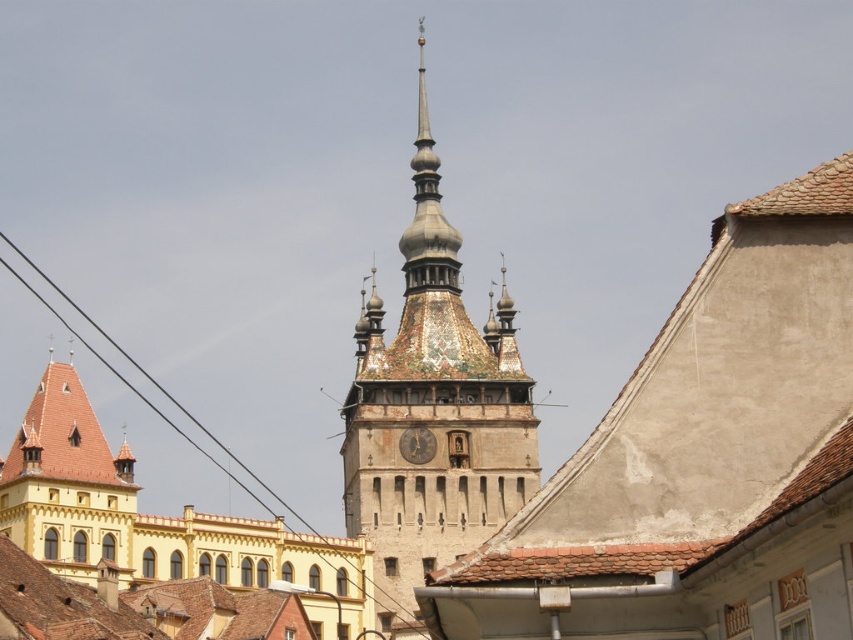
Question: Based on their relative distances, which object is nearer to the yellow brick building at left?

Choices:
 (A) multicolored mosaic clock tower at center
 (B) gold textured clock at center
 (C) brown stone clock tower at center

Answer: (A)

Question: Is multicolored mosaic clock tower at center wider than yellow brick building at left?

Choices:
 (A) no
 (B) yes

Answer: (A)

Question: Can you confirm if multicolored mosaic clock tower at center is positioned below yellow brick building at left?

Choices:
 (A) no
 (B) yes

Answer: (A)

Question: Which point is farther from the camera taking this photo?

Choices:
 (A) (51, 528)
 (B) (421, 460)
 (C) (426, 106)
 (D) (556, 593)

Answer: (C)

Question: Does brown stone clock tower at center appear over yellow brick building at left?

Choices:
 (A) yes
 (B) no

Answer: (A)

Question: Which point appears closest to the camera in this image?

Choices:
 (A) [x=432, y=390]
 (B) [x=427, y=458]
 (C) [x=639, y=531]
 (D) [x=0, y=492]

Answer: (C)